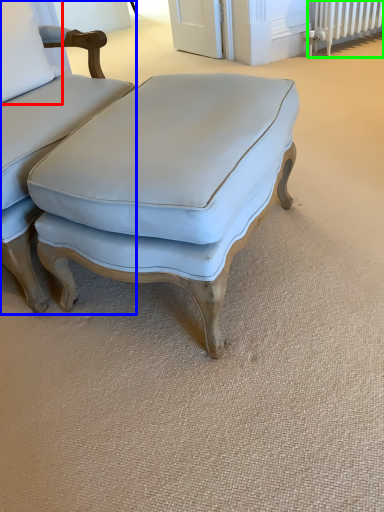
Question: Estimate the real-world distances between objects in this image. Which object is farther from pillow (highlighted by a red box), chair (highlighted by a blue box) or radiator (highlighted by a green box)?

Choices:
 (A) chair
 (B) radiator

Answer: (B)